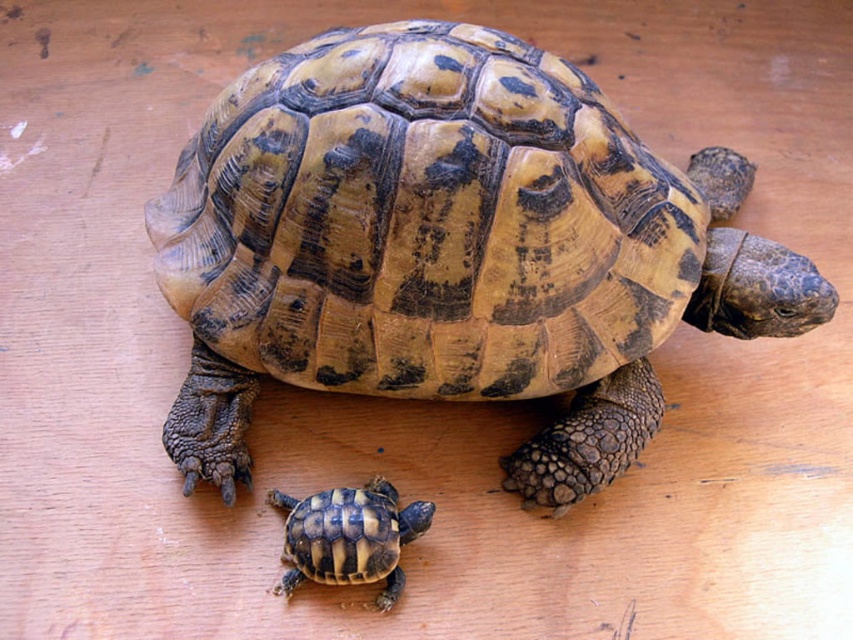
Is yellowish-brown scaly tortoise at center bigger than brown textured tortoise at lower center?

Indeed, yellowish-brown scaly tortoise at center has a larger size compared to brown textured tortoise at lower center.

Measure the distance from yellowish-brown scaly tortoise at center to brown textured tortoise at lower center.

yellowish-brown scaly tortoise at center and brown textured tortoise at lower center are 12.26 inches apart from each other.

Between point (631, 152) and point (288, 513), which one is positioned in front?

Point (288, 513) is in front.

The width and height of the screenshot is (853, 640). What are the coordinates of `yellowish-brown scaly tortoise at center` in the screenshot? It's located at (450, 248).